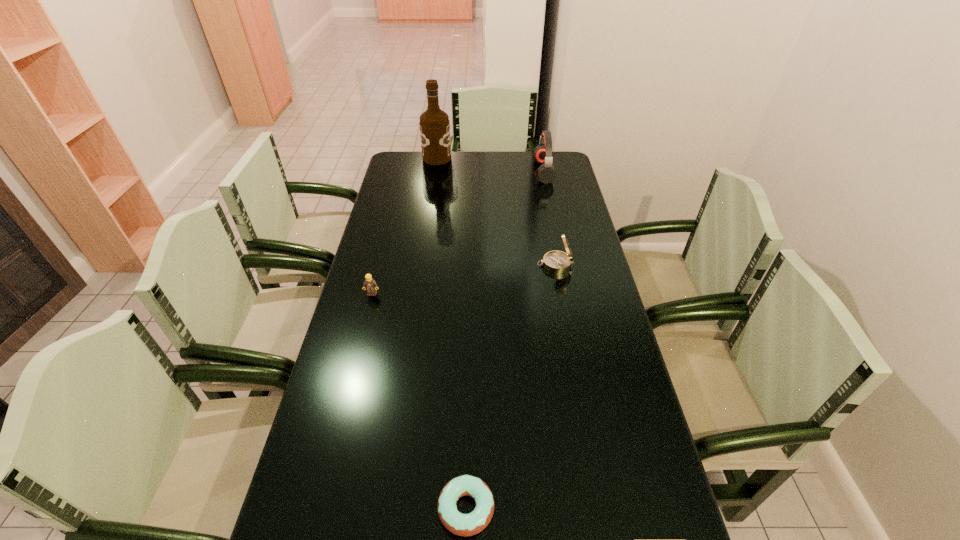
This screenshot has width=960, height=540. Find the location of `object that can be found as the third closest to the third shortest object`. object that can be found as the third closest to the third shortest object is located at coordinates (460, 524).

At what (x,y) coordinates should I click in order to perform the action: click on the second closest object to the doughnut. Please return your answer as a coordinate pair (x, y). Image resolution: width=960 pixels, height=540 pixels. Looking at the image, I should click on 558,262.

At what (x,y) coordinates should I click in order to perform the action: click on free location that satisfies the following two spatial constraints: 1. on the label of the second object from left to right; 2. in front of the Lego. Please return your answer as a coordinate pair (x, y). Looking at the image, I should click on (418, 294).

Where is `free location that satisfies the following two spatial constraints: 1. on the label of the alcohol; 2. on the back side of the third object from right to left`? free location that satisfies the following two spatial constraints: 1. on the label of the alcohol; 2. on the back side of the third object from right to left is located at coordinates (386, 508).